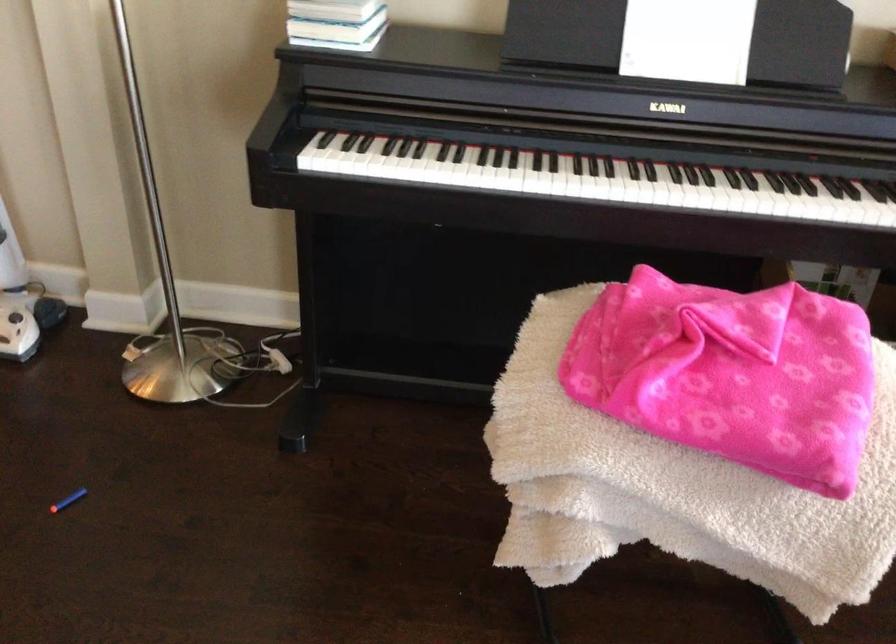
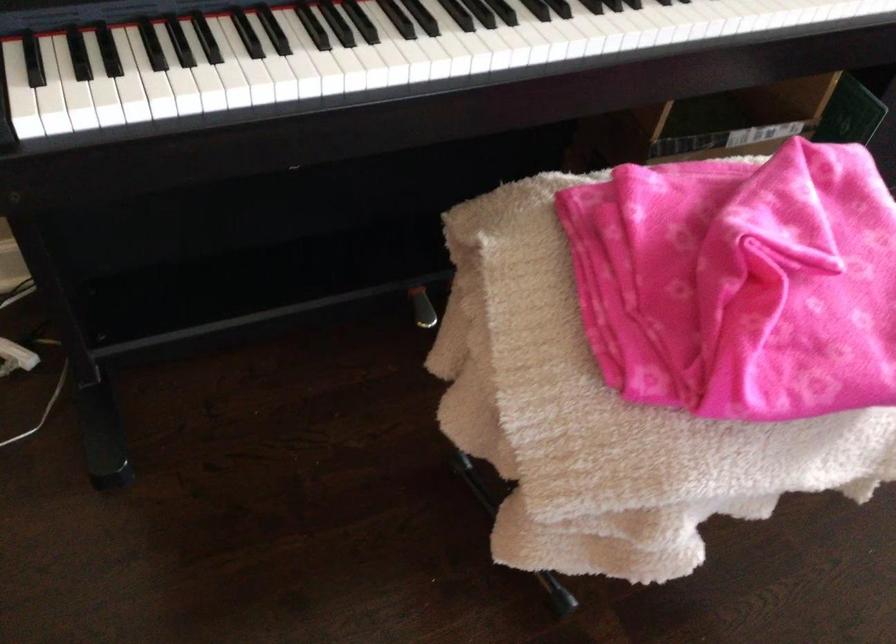
Where in the second image is the point corresponding to the point at 340,144 from the first image?

(87, 80)